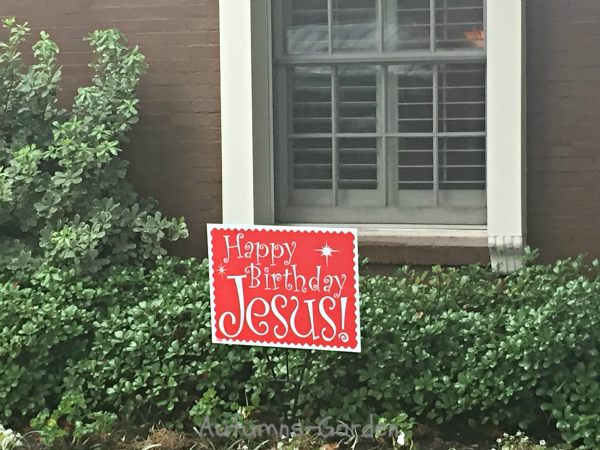
Image resolution: width=600 pixels, height=450 pixels. What are the coordinates of `window` in the screenshot? It's located at (381, 136).